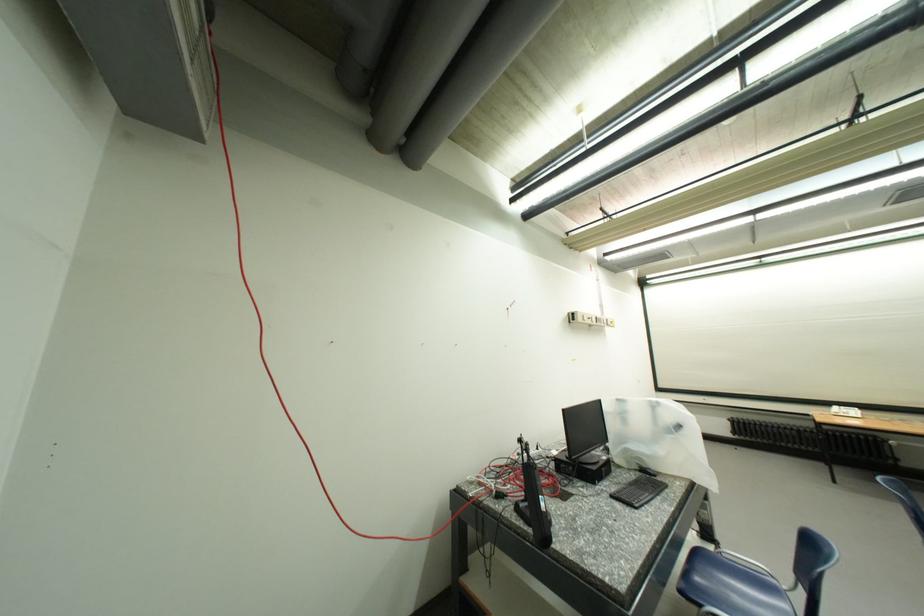
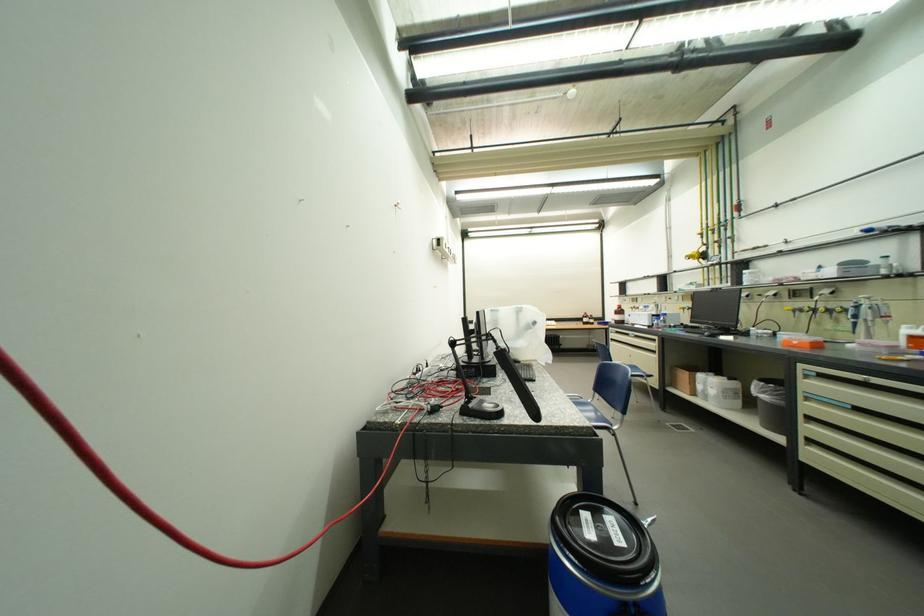
Question: Based on the continuous images, in which direction is the camera rotating? Reply with the corresponding letter.

Choices:
 (A) Left
 (B) Right
 (C) Up
 (D) Down

Answer: (B)